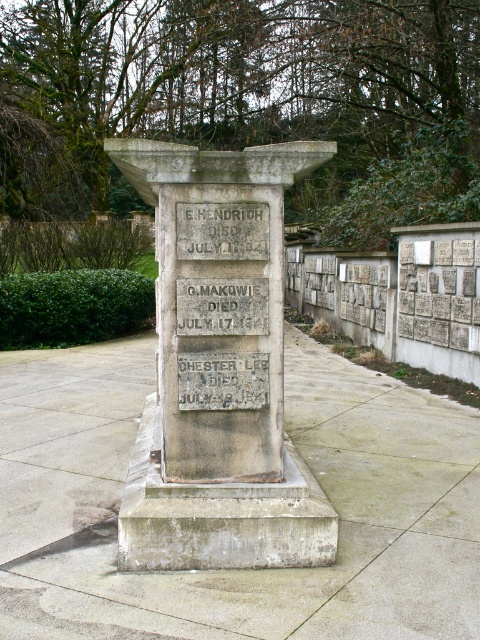
Question: Is gray stone monument at center closer to camera compared to white stone plaque at center?

Choices:
 (A) yes
 (B) no

Answer: (A)

Question: Considering the relative positions of gray stone monument at center and white stone plaque at center in the image provided, where is gray stone monument at center located with respect to white stone plaque at center?

Choices:
 (A) below
 (B) above

Answer: (A)

Question: Can you confirm if gray stone monument at center is wider than white stone plaque at center?

Choices:
 (A) yes
 (B) no

Answer: (A)